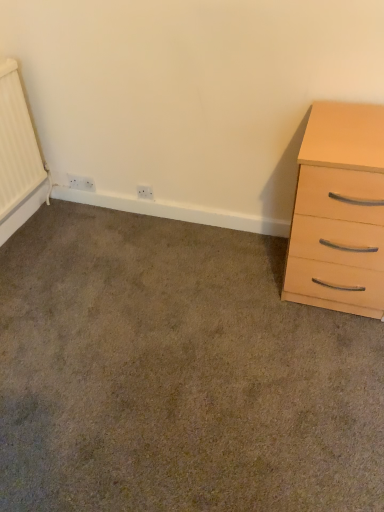
The height and width of the screenshot is (512, 384). Find the location of `vacant space situated above carpet at lower left (from a real-world perspective)`. vacant space situated above carpet at lower left (from a real-world perspective) is located at coordinates (151, 317).